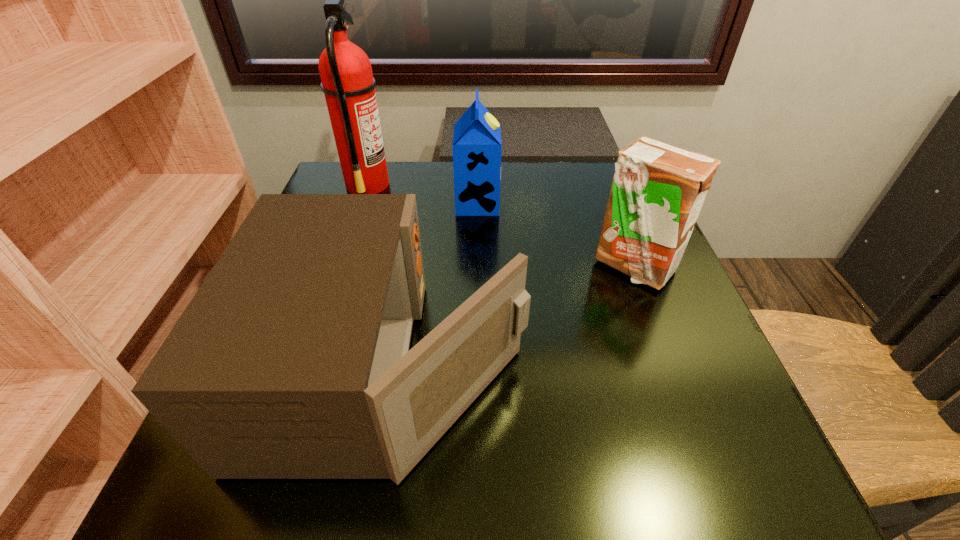
Where is `vacant area at the far right corner`? Image resolution: width=960 pixels, height=540 pixels. vacant area at the far right corner is located at coordinates (582, 166).

Identify the location of empty location between the rightmost object and the left carton. (556, 235).

Image resolution: width=960 pixels, height=540 pixels. What are the coordinates of `vacant area that lies between the fire extinguisher and the rightmost object` in the screenshot? It's located at (501, 225).

Find the location of a particular element. This screenshot has width=960, height=540. free point between the left carton and the rightmost object is located at coordinates (556, 235).

Identify the location of free area in between the microwave oven and the farther carton. This screenshot has width=960, height=540. (436, 286).

You are a GUI agent. You are given a task and a screenshot of the screen. Output one action in this format:
    pyautogui.click(x=<x>, y=<y>)
    Task: Click on the blank region between the fire extinguisher and the farther carton
    The image size is (960, 540).
    Given the screenshot: What is the action you would take?
    pyautogui.click(x=422, y=194)

Locate an element on the screen. The height and width of the screenshot is (540, 960). vacant point located between the microwave oven and the farther carton is located at coordinates (436, 286).

Locate an element on the screen. free spot between the left carton and the microwave oven is located at coordinates (436, 286).

In order to click on free space that is in between the left carton and the shortest object in this screenshot , I will do `click(436, 286)`.

Image resolution: width=960 pixels, height=540 pixels. In order to click on free space that is in between the microwave oven and the left carton in this screenshot , I will do `click(436, 286)`.